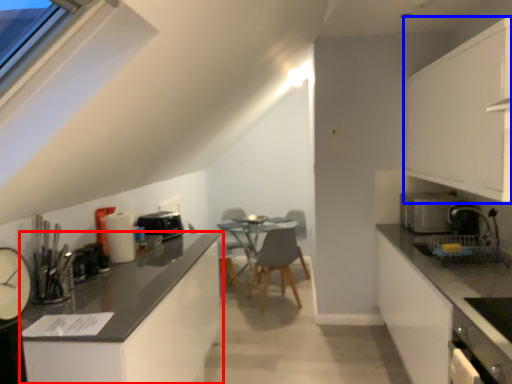
Question: Which point is further to the camera, cabinetry (highlighted by a red box) or cabinetry (highlighted by a blue box)?

Choices:
 (A) cabinetry
 (B) cabinetry

Answer: (B)